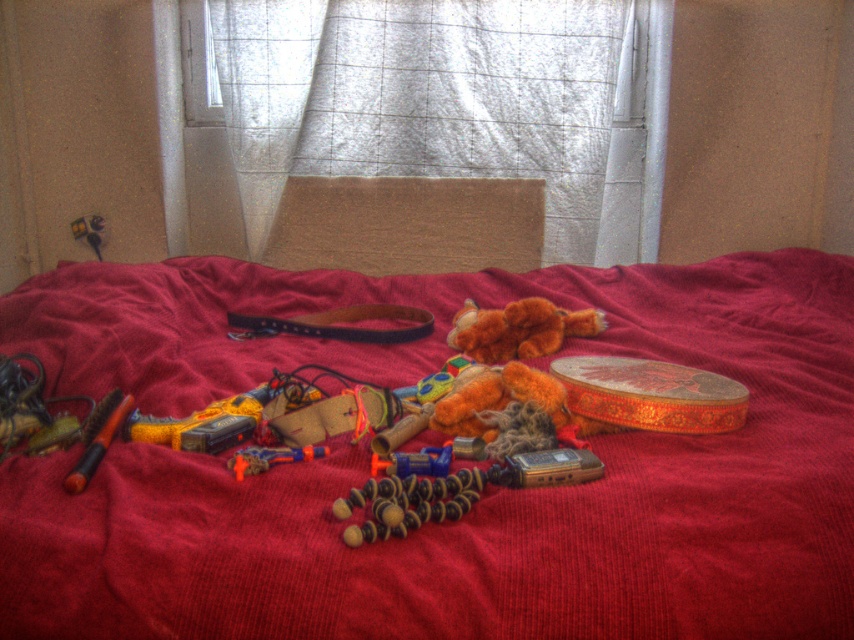
Question: Does white sheer curtain at upper center lie behind orange matte pen at lower left?

Choices:
 (A) no
 (B) yes

Answer: (B)

Question: Which of the following is the farthest from the observer?

Choices:
 (A) metallic gold phone at center
 (B) orange plastic toy gun at center

Answer: (B)

Question: Is white sheer curtain at upper center thinner than orange matte pen at lower left?

Choices:
 (A) yes
 (B) no

Answer: (B)

Question: Based on their relative distances, which object is farther from the velvet red bedspread at center?

Choices:
 (A) metallic gold phone at center
 (B) orange matte pen at lower left

Answer: (B)

Question: Can you confirm if white sheer curtain at upper center is positioned above orange matte pen at lower left?

Choices:
 (A) yes
 (B) no

Answer: (A)

Question: Which object is positioned farthest from the metallic gold phone at center?

Choices:
 (A) wooden beads at center
 (B) velvet red bedspread at center
 (C) orange matte pen at lower left

Answer: (B)